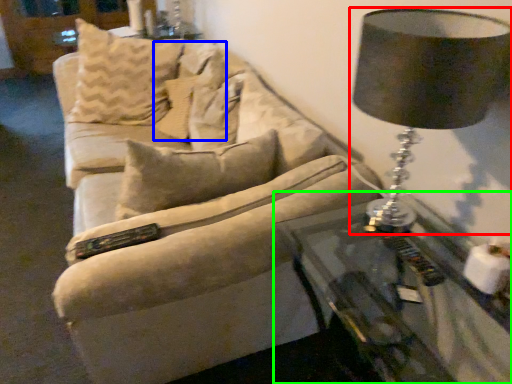
Question: Which object is positioned closest to lamp (highlighted by a red box)? Select from pillow (highlighted by a blue box) and table (highlighted by a green box).

Choices:
 (A) pillow
 (B) table

Answer: (B)